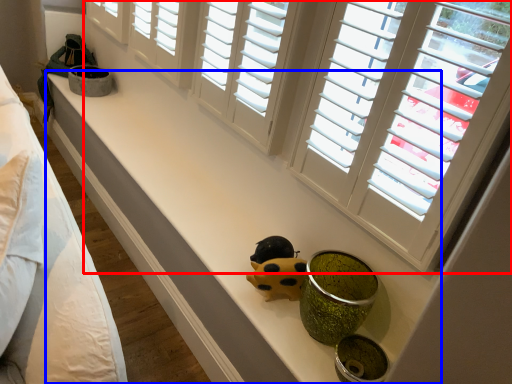
Question: Which of the following is the closest to the observer, window (highlighted by a red box) or counter top (highlighted by a blue box)?

Choices:
 (A) window
 (B) counter top

Answer: (A)